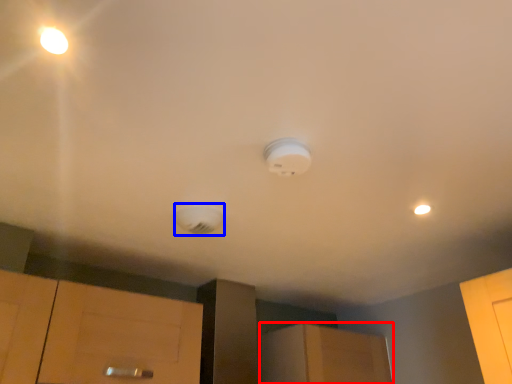
Question: Which point is closer to the camera, cabinetry (highlighted by a red box) or lamp (highlighted by a blue box)?

Choices:
 (A) cabinetry
 (B) lamp

Answer: (B)